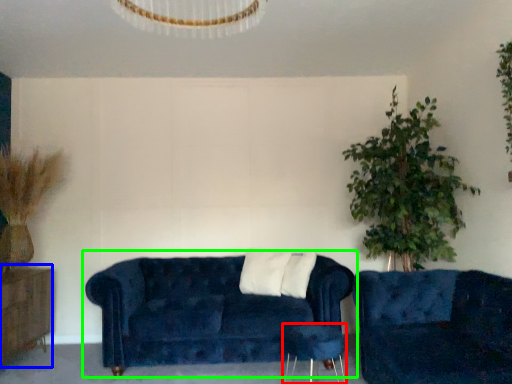
Question: Considering the real-world distances, which object is farthest from side table (highlighted by a red box)? dresser (highlighted by a blue box) or studio couch (highlighted by a green box)?

Choices:
 (A) dresser
 (B) studio couch

Answer: (A)